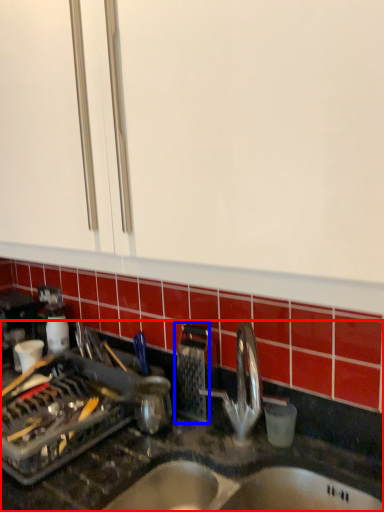
Question: Among these objects, which one is farthest to the camera, countertop (highlighted by a red box) or appliance (highlighted by a blue box)?

Choices:
 (A) countertop
 (B) appliance

Answer: (B)